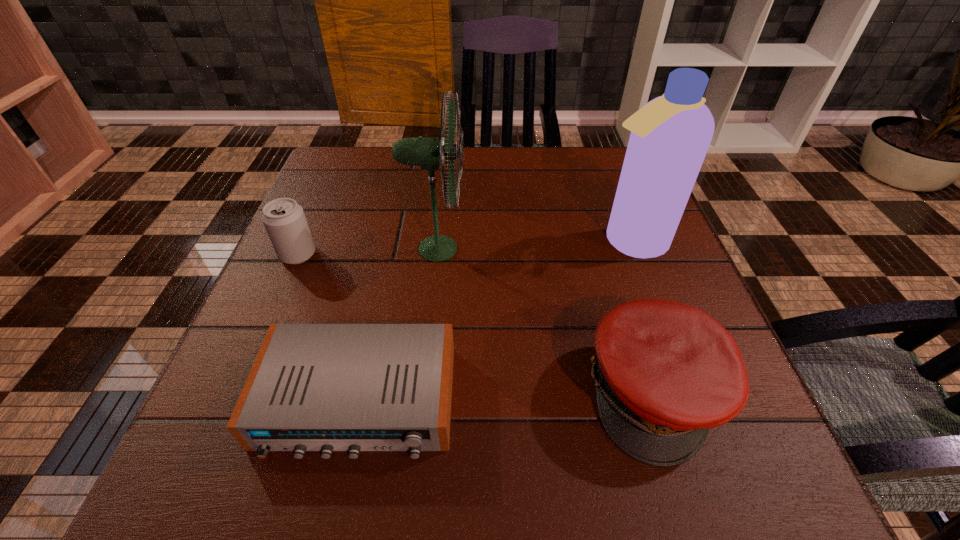
At what (x,y) coordinates should I click in order to perform the action: click on radio receiver located at the near edge. Please return your answer as a coordinate pair (x, y). This screenshot has width=960, height=540. Looking at the image, I should click on (313, 387).

Locate an element on the screen. can that is at the left edge is located at coordinates [x=284, y=220].

Locate an element on the screen. The height and width of the screenshot is (540, 960). radio receiver positioned at the left edge is located at coordinates (313, 387).

Image resolution: width=960 pixels, height=540 pixels. Find the location of `shampoo located at the right edge`. shampoo located at the right edge is located at coordinates (670, 135).

I want to click on cap located in the right edge section of the desktop, so click(x=666, y=372).

This screenshot has width=960, height=540. I want to click on object present at the near left corner, so click(x=313, y=387).

The height and width of the screenshot is (540, 960). Find the location of `object present at the near right corner`. object present at the near right corner is located at coordinates [x=666, y=372].

The width and height of the screenshot is (960, 540). Find the location of `vacant space at the far edge`. vacant space at the far edge is located at coordinates (407, 183).

Image resolution: width=960 pixels, height=540 pixels. I want to click on free space at the near edge of the desktop, so (451, 467).

Where is `free space at the left edge of the desktop`? This screenshot has width=960, height=540. free space at the left edge of the desktop is located at coordinates (247, 333).